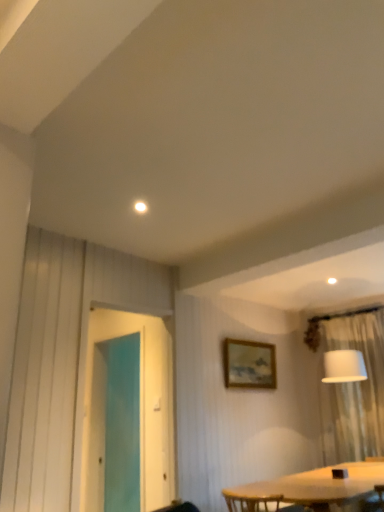
Where is `white sheer curtain at right`? Image resolution: width=384 pixels, height=512 pixels. white sheer curtain at right is located at coordinates (354, 391).

The image size is (384, 512). What do you see at coordinates (140, 409) in the screenshot? I see `transparent glass screen door at left` at bounding box center [140, 409].

Measure the distance between point (238,359) and camera.

The depth of point (238,359) is 4.56 meters.

The width and height of the screenshot is (384, 512). I want to click on white sheer curtain at right, so click(354, 391).

Considering the sizes of wooden frame at upper center and transparent glass screen door at left in the image, is wooden frame at upper center wider or thinner than transparent glass screen door at left?

Clearly, wooden frame at upper center has less width compared to transparent glass screen door at left.

From the image's perspective, which one is positioned higher, wooden frame at upper center or transparent glass screen door at left?

transparent glass screen door at left appears higher in the image.

Would you say wooden frame at upper center is to the left or to the right of transparent glass screen door at left in the picture?

wooden frame at upper center is to the right of transparent glass screen door at left.

Considering the relative sizes of white sheer curtain at right and wooden frame at upper center in the image provided, is white sheer curtain at right thinner than wooden frame at upper center?

Incorrect, the width of white sheer curtain at right is not less than that of wooden frame at upper center.

Between point (354, 388) and point (228, 362), which one is positioned in front?

The point (228, 362) is more forward.

From the image's perspective, is white sheer curtain at right positioned above or below wooden frame at upper center?

Clearly, from the image's perspective, white sheer curtain at right is below wooden frame at upper center.

Which object is more forward, white sheer curtain at right or wooden frame at upper center?

white sheer curtain at right is in front.

Is transparent glass screen door at left wider or thinner than white sheer curtain at right?

Considering their sizes, transparent glass screen door at left looks slimmer than white sheer curtain at right.

Which point is more distant from viewer, [156,435] or [321,412]?

Point [321,412]

Between transparent glass screen door at left and white sheer curtain at right, which one has smaller size?

Smaller between the two is transparent glass screen door at left.

Can you confirm if transparent glass screen door at left is wider than wooden frame at upper center?

Yes.

In the scene shown: From their relative heights in the image, would you say transparent glass screen door at left is taller or shorter than wooden frame at upper center?

Clearly, transparent glass screen door at left is taller compared to wooden frame at upper center.

Considering their positions, is transparent glass screen door at left located in front of or behind wooden frame at upper center?

Visually, transparent glass screen door at left is located in front of wooden frame at upper center.

Which point is more forward, (157,435) or (227,353)?

The point (157,435) is closer to the camera.

Consider the image. Is white sheer curtain at right oriented away from transparent glass screen door at left?

white sheer curtain at right does not have its back to transparent glass screen door at left.

Would you consider white sheer curtain at right to be distant from transparent glass screen door at left?

Yes, white sheer curtain at right is far from transparent glass screen door at left.

You are a GUI agent. You are given a task and a screenshot of the screen. Output one action in this format:
    pyautogui.click(x=<x>, y=<y>)
    Task: Click on the curtain below the transparent glass screen door at left (from the image's perspective)
    This screenshot has height=512, width=384.
    Given the screenshot: What is the action you would take?
    pyautogui.click(x=354, y=391)

From a real-world perspective, which is physically below, white sheer curtain at right or transparent glass screen door at left?

From a 3D spatial view, white sheer curtain at right is below.

Consider the image. From a real-world perspective, does wooden frame at upper center sit lower than white sheer curtain at right?

No.

Is wooden frame at upper center thinner than white sheer curtain at right?

Yes.

Looking at the image, does wooden frame at upper center seem bigger or smaller compared to white sheer curtain at right?

In the image, wooden frame at upper center appears to be smaller than white sheer curtain at right.

Is the depth of wooden frame at upper center greater than that of white sheer curtain at right?

Yes, wooden frame at upper center is further from the camera.

Locate an element on the screen. Image resolution: width=384 pixels, height=512 pixels. screen door that is under the wooden frame at upper center (from a real-world perspective) is located at coordinates (140, 409).

This screenshot has height=512, width=384. I want to click on picture frame behind the white sheer curtain at right, so click(x=249, y=364).

Looking at the image, which one is located closer to wooden frame at upper center, white sheer curtain at right or transparent glass screen door at left?

The object closer to wooden frame at upper center is transparent glass screen door at left.

Looking at the image, which one is located further to transparent glass screen door at left, white sheer curtain at right or wooden frame at upper center?

white sheer curtain at right.

When comparing their distances from transparent glass screen door at left, does wooden frame at upper center or white sheer curtain at right seem further?

Based on the image, white sheer curtain at right appears to be further to transparent glass screen door at left.

From the image, which object appears to be nearer to white sheer curtain at right, wooden frame at upper center or transparent glass screen door at left?

Among the two, wooden frame at upper center is located nearer to white sheer curtain at right.

When comparing their distances from wooden frame at upper center, does transparent glass screen door at left or white sheer curtain at right seem further?

white sheer curtain at right.

Estimate the real-world distances between objects in this image. Which object is closer to white sheer curtain at right, transparent glass screen door at left or wooden frame at upper center?

Among the two, wooden frame at upper center is located nearer to white sheer curtain at right.

Where is `picture frame situated between transparent glass screen door at left and white sheer curtain at right from left to right`? The image size is (384, 512). picture frame situated between transparent glass screen door at left and white sheer curtain at right from left to right is located at coordinates (249, 364).